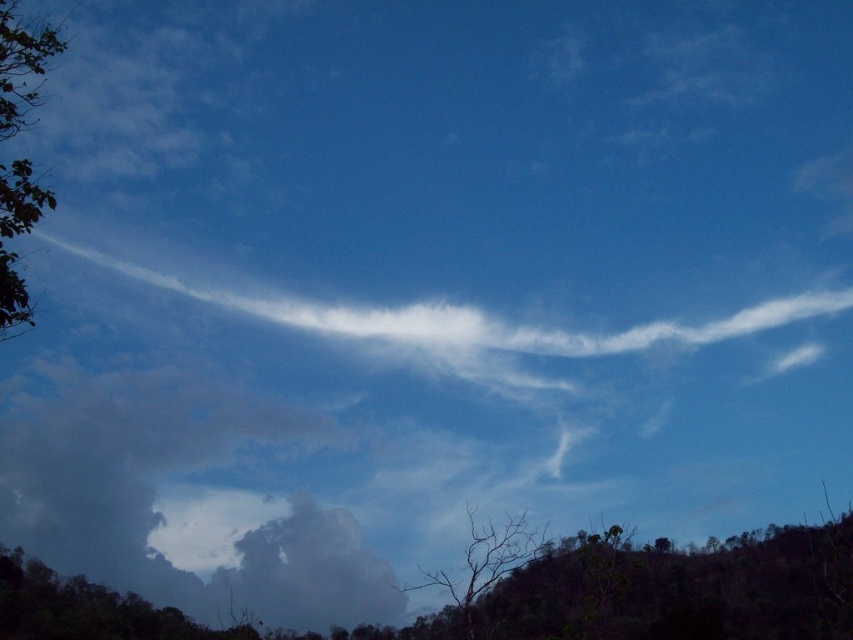
You are an observer looking at the sky scene. You notice the green leafy tree at left and the bare wood tree at lower center. Which tree is located to the right of the other?

The green leafy tree at left is positioned on the left side of the bare wood tree at lower center, so the bare wood tree at lower center is to the right of the green leafy tree at left.

You are an environmental scientist analyzing the image. You need to determine which tree has a wider canopy. Based on the scene, which tree between the green leafy tree at lower left and the green leafy tree at left has a wider canopy?

The green leafy tree at lower left has a wider canopy since its width is larger than that of the green leafy tree at left.

You are an astronomer observing the sky from the ground. You notice two points in the sky labeled as point (x=15, y=168) and point (x=474, y=554). Which point is closer to your line of sight?

Point (x=15, y=168) is in front of point (x=474, y=554), so it is closer to your line of sight.